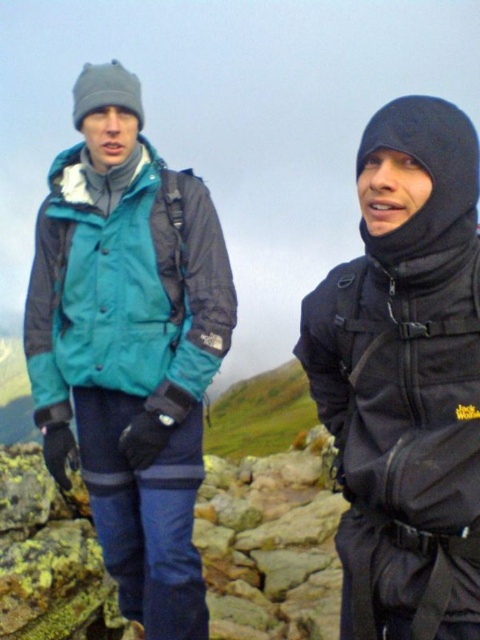
How much distance is there between black softshell jacket at right and teal fabric jacket at left?

black softshell jacket at right and teal fabric jacket at left are 3.23 meters apart from each other.

Between black softshell jacket at right and teal fabric jacket at left, which one is positioned lower?

Positioned lower is teal fabric jacket at left.

Where is `black softshell jacket at right`? This screenshot has height=640, width=480. black softshell jacket at right is located at coordinates (406, 378).